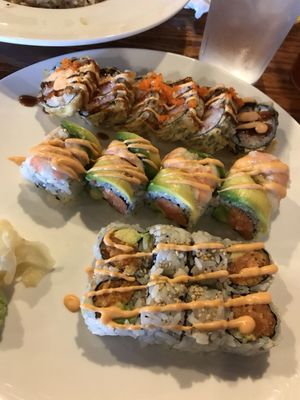
You are a GUI agent. You are given a task and a screenshot of the screen. Output one action in this format:
    pyautogui.click(x=<x>, y=<y>)
    Task: Click on the crumpled napkin
    
    Given the screenshot: What is the action you would take?
    pyautogui.click(x=200, y=10)